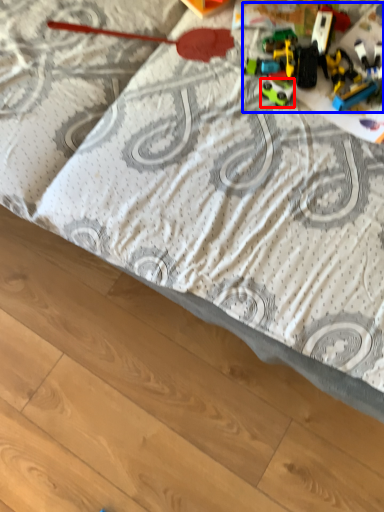
Question: Which of the following is the farthest to the observer, toy (highlighted by a red box) or toy (highlighted by a blue box)?

Choices:
 (A) toy
 (B) toy

Answer: (A)